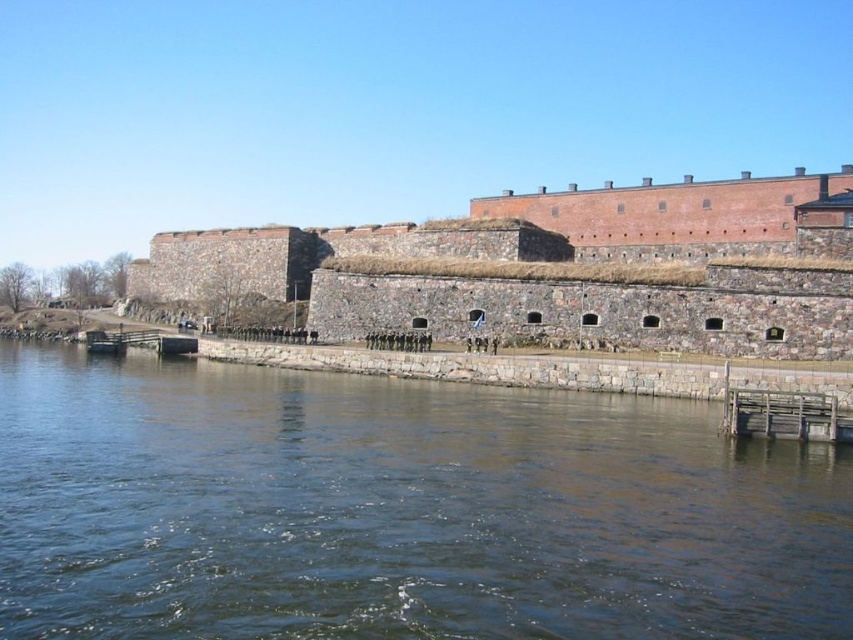
You are standing at the base of the fortress and want to reach the point marked as point (791, 573). The fortress walls are 3 meters thick. Can you walk directly to that point without going through the walls?

The point (791, 573) is 36.11 meters from the viewer. Since the fortress walls are only 3 meters thick, you can safely walk to that point without encountering the walls as the distance is much greater than the wall thickness.

You are standing at the edge of the wooden planks at lower right and want to walk towards the brown stone castle at center. Which direction should you head?

You should head towards the direction of the brown stone castle at center because it is closer to you than the wooden planks at lower right, so moving towards it would be the correct direction.